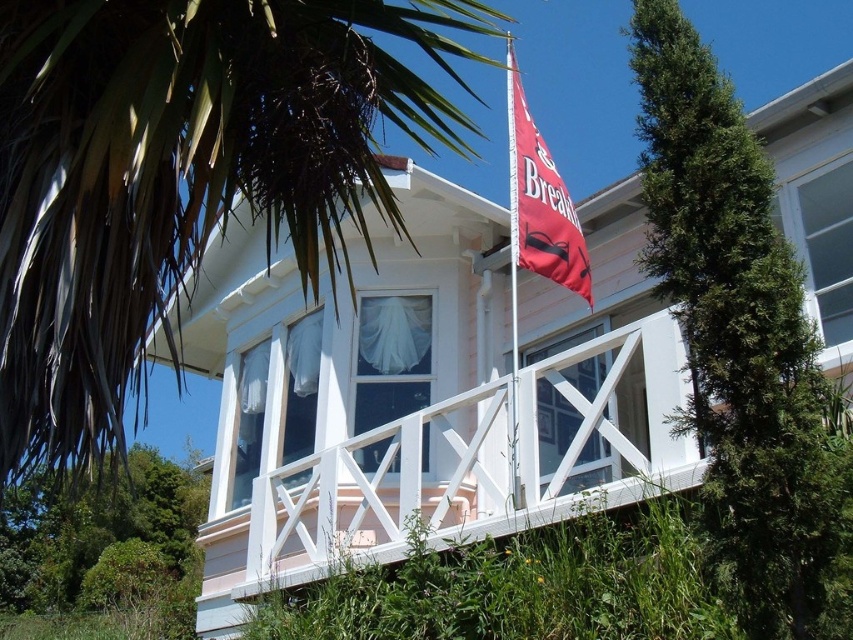
You are standing in front of the house and notice the green leafy palm tree at upper left and the metallic flag pole at center. Which object is positioned more to the left side of the scene?

The green leafy palm tree at upper left is positioned more to the left side of the scene compared to the metallic flag pole at center.

You are standing on the porch of the white two story house and want to hang a new wind chime. The wind chime needs to be placed below both the green leafy palm tree at upper left and the red fabric flag at upper center. Is this possible?

The green leafy palm tree at upper left is taller than the red fabric flag at upper center, so the wind chime can be placed below both by positioning it under the lower part of the palm tree and below the flag.